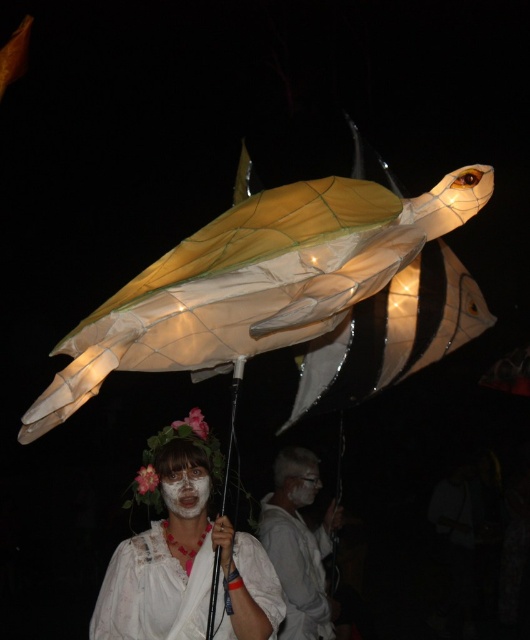
You are a photographer trying to capture the face of the person holding the sea turtle kite. You notice the white lace dress at center and the white matte face mask at center. Which object is closer to the camera?

The white matte face mask at center is closer to the camera because the white lace dress at center is positioned under it.